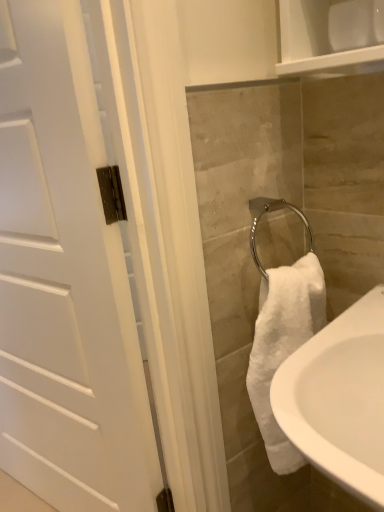
Question: Does white ceramic sink at lower right have a lesser height compared to white matte door at left?

Choices:
 (A) yes
 (B) no

Answer: (A)

Question: Can you confirm if white ceramic sink at lower right is positioned to the left of white matte door at left?

Choices:
 (A) yes
 (B) no

Answer: (B)

Question: From the image's perspective, is white ceramic sink at lower right on white matte door at left?

Choices:
 (A) no
 (B) yes

Answer: (A)

Question: Considering the relative sizes of white ceramic sink at lower right and white matte door at left in the image provided, is white ceramic sink at lower right bigger than white matte door at left?

Choices:
 (A) no
 (B) yes

Answer: (A)

Question: From the image's perspective, is white ceramic sink at lower right located beneath white matte door at left?

Choices:
 (A) no
 (B) yes

Answer: (B)

Question: Is white ceramic sink at lower right outside of white matte door at left?

Choices:
 (A) yes
 (B) no

Answer: (A)

Question: Is white matte door at left thinner than white ceramic sink at lower right?

Choices:
 (A) no
 (B) yes

Answer: (B)

Question: From the image's perspective, does white matte door at left appear higher than white ceramic sink at lower right?

Choices:
 (A) yes
 (B) no

Answer: (A)

Question: Can you confirm if white matte door at left is smaller than white ceramic sink at lower right?

Choices:
 (A) yes
 (B) no

Answer: (B)

Question: Is white matte door at left at the right side of white ceramic sink at lower right?

Choices:
 (A) yes
 (B) no

Answer: (B)

Question: Is white matte door at left not close to white ceramic sink at lower right?

Choices:
 (A) no
 (B) yes

Answer: (A)

Question: Is white matte door at left shorter than white ceramic sink at lower right?

Choices:
 (A) no
 (B) yes

Answer: (A)

Question: Relative to white ceramic sink at lower right, is white matte door at left in front or behind?

Choices:
 (A) front
 (B) behind

Answer: (B)